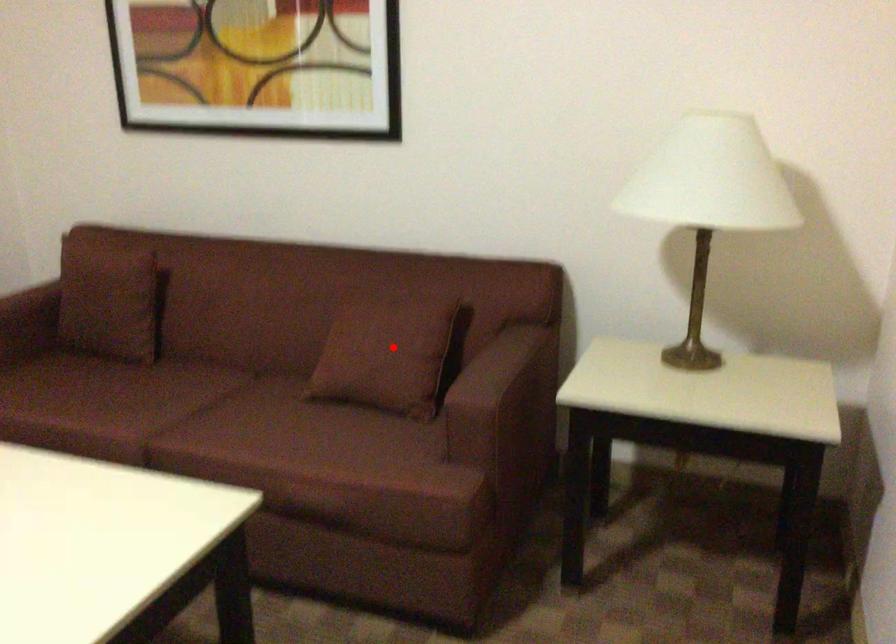
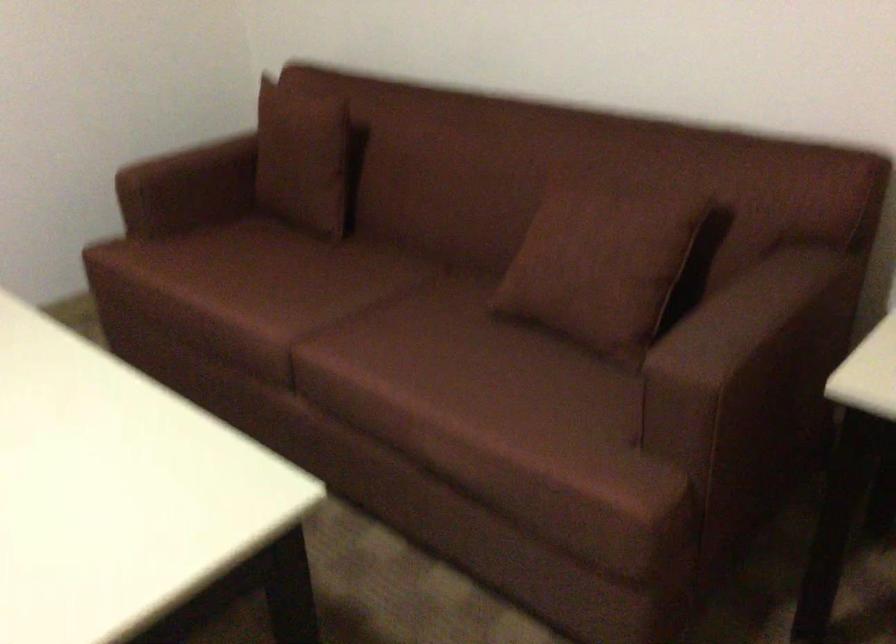
Question: I am providing you with two images of the same scene from different viewpoints. Given a red point in image1, look at the same physical point in image2. Is it:

Choices:
 (A) Closer to the viewpoint
 (B) Farther from the viewpoint

Answer: (A)